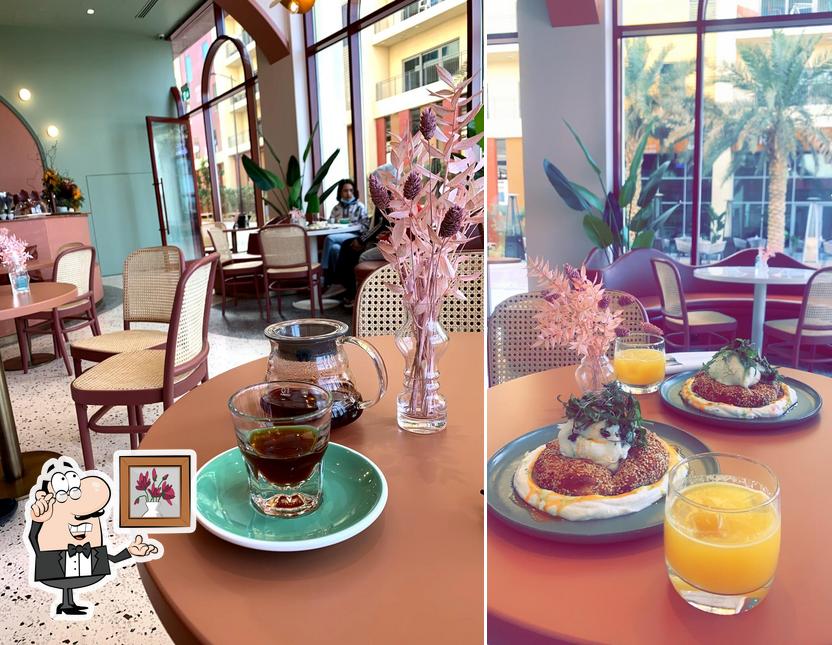
The height and width of the screenshot is (645, 832). I want to click on plate, so click(x=348, y=508), click(x=685, y=439), click(x=810, y=408).